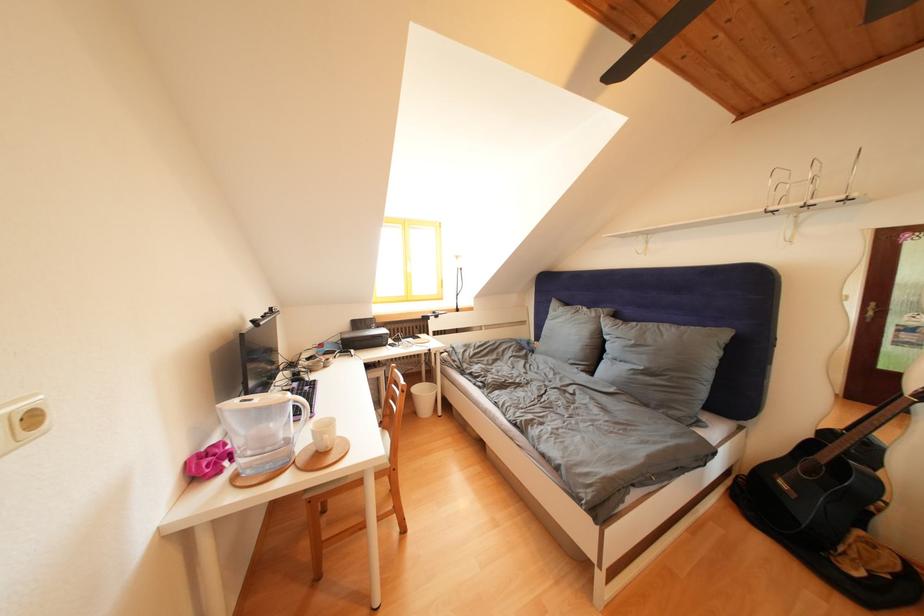
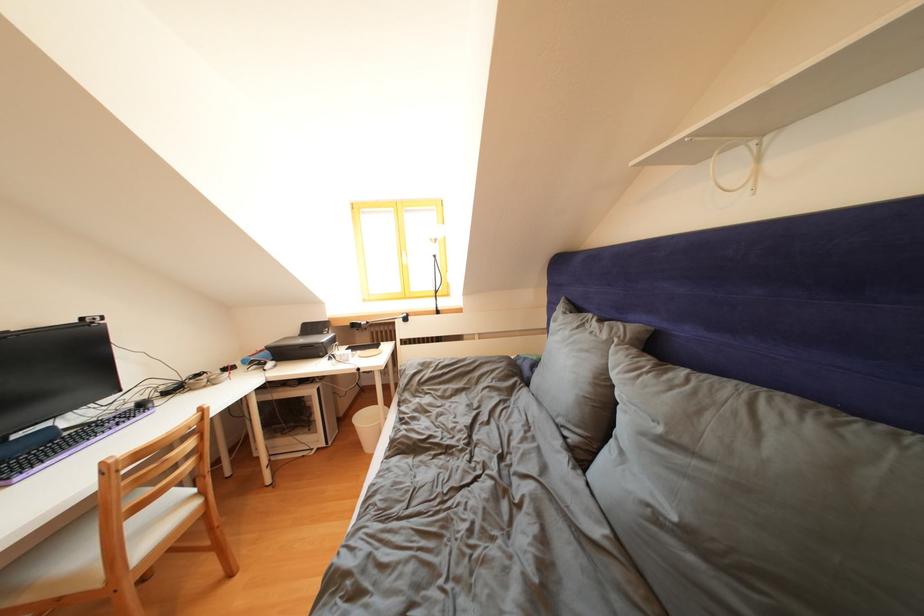
Where in the second image is the point corresponding to (x=602, y=320) from the first image?

(612, 341)